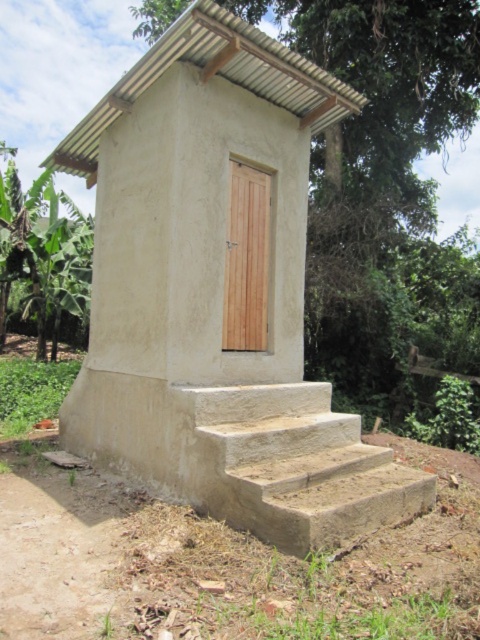
Is light brown concrete stairs at lower center taller than green leafy banana tree at left?

No, light brown concrete stairs at lower center is not taller than green leafy banana tree at left.

Which is in front, point (192, 468) or point (29, 218)?

Positioned in front is point (192, 468).

This screenshot has height=640, width=480. Find the location of `light brown concrete stairs at lower center`. light brown concrete stairs at lower center is located at coordinates (294, 467).

Which is in front, point (365, 529) or point (240, 252)?

Point (365, 529)

Which of these two, light brown concrete stairs at lower center or light brown wood door at center, stands taller?

With more height is light brown wood door at center.

What do you see at coordinates (294, 467) in the screenshot? I see `light brown concrete stairs at lower center` at bounding box center [294, 467].

Find the location of `light brown concrete stairs at lower center`. light brown concrete stairs at lower center is located at coordinates (294, 467).

Find the location of a particular element. matte concrete hut at center is located at coordinates (216, 294).

What do you see at coordinates (216, 294) in the screenshot?
I see `matte concrete hut at center` at bounding box center [216, 294].

The width and height of the screenshot is (480, 640). I want to click on matte concrete hut at center, so click(216, 294).